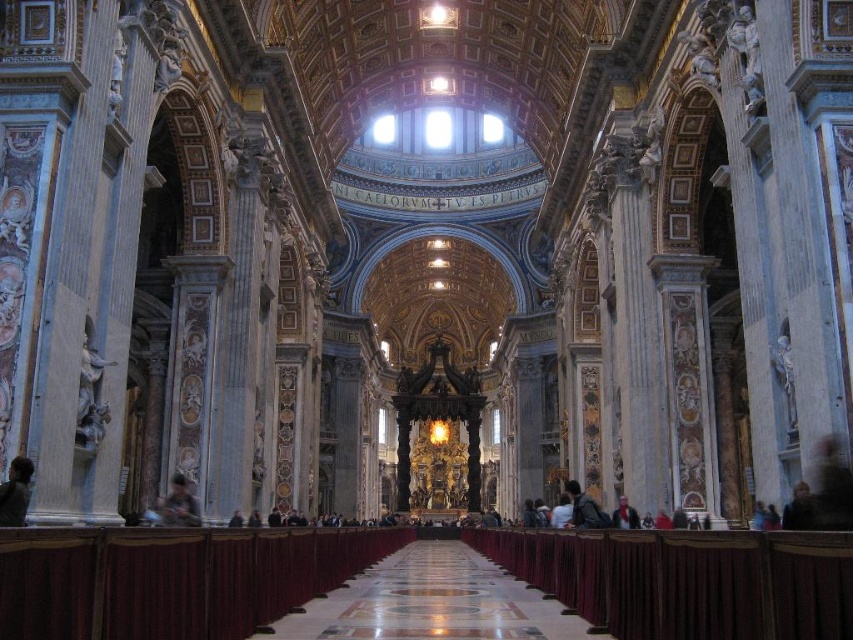
Is point (175, 522) less distant than point (619, 528)?

Yes.

Is dark brown leather jacket at lower left bigger than dark gray suit at center?

No.

The height and width of the screenshot is (640, 853). What do you see at coordinates (178, 504) in the screenshot?
I see `dark brown leather jacket at lower left` at bounding box center [178, 504].

The image size is (853, 640). What are the coordinates of `dark brown leather jacket at lower left` in the screenshot? It's located at (178, 504).

I want to click on brown leather jacket at lower left, so click(15, 492).

Which is more to the right, brown leather jacket at lower left or white fabric person at center?

white fabric person at center is more to the right.

Which is in front, point (19, 492) or point (556, 500)?

Point (19, 492)

Locate an element on the screen. The height and width of the screenshot is (640, 853). brown leather jacket at lower left is located at coordinates (15, 492).

Is brown leather jacket at lower left below dark gray suit at center?

Actually, brown leather jacket at lower left is above dark gray suit at center.

This screenshot has height=640, width=853. In order to click on brown leather jacket at lower left in this screenshot , I will do `click(15, 492)`.